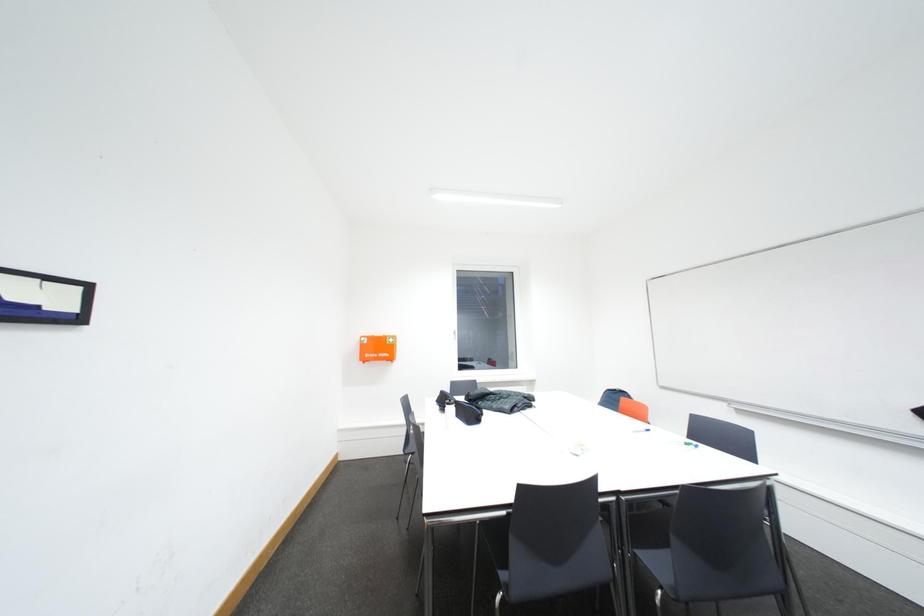
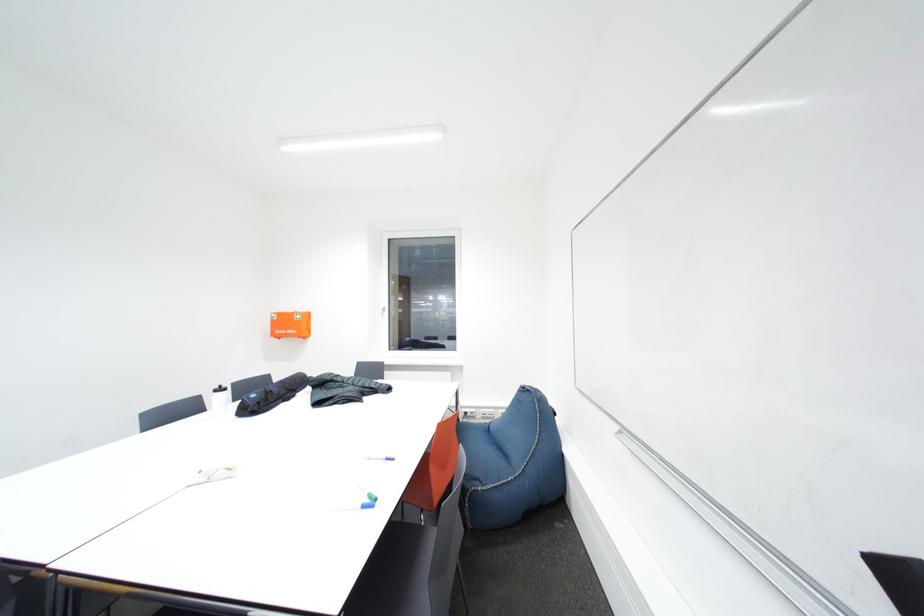
In a continuous first-person perspective shot, in which direction is the camera moving?

The cameraman walked toward right, forward.